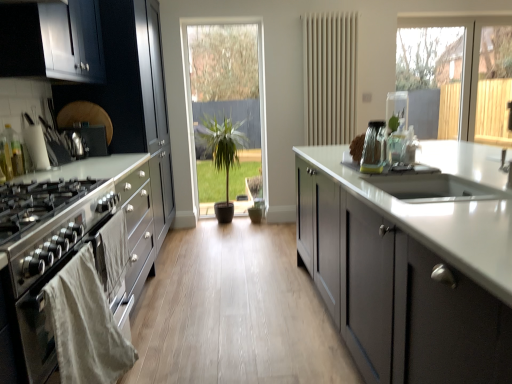
Question: Is beige matte radiator at center oriented away from satin black cabinets at left, which ranks as the 2th cabinetry in right-to-left order?

Choices:
 (A) no
 (B) yes

Answer: (A)

Question: Considering the relative sizes of beige matte radiator at center and satin black cabinets at left, which ranks as the 2th cabinetry in right-to-left order, in the image provided, is beige matte radiator at center smaller than satin black cabinets at left, which ranks as the 2th cabinetry in right-to-left order,?

Choices:
 (A) no
 (B) yes

Answer: (B)

Question: From the image's perspective, is beige matte radiator at center located above satin black cabinets at left, which ranks as the 2th cabinetry in right-to-left order?

Choices:
 (A) yes
 (B) no

Answer: (A)

Question: Considering the relative sizes of beige matte radiator at center and satin black cabinets at left, which ranks as the 2th cabinetry in right-to-left order, in the image provided, is beige matte radiator at center thinner than satin black cabinets at left, which ranks as the 2th cabinetry in right-to-left order,?

Choices:
 (A) yes
 (B) no

Answer: (A)

Question: Is beige matte radiator at center positioned in front of satin black cabinets at left, the first cabinetry positioned from the left?

Choices:
 (A) no
 (B) yes

Answer: (A)

Question: Considering the positions of beige matte radiator at center and clear glass jars at right, positioned as the 2th appliance in back-to-front order, in the image, is beige matte radiator at center taller or shorter than clear glass jars at right, positioned as the 2th appliance in back-to-front order,?

Choices:
 (A) tall
 (B) short

Answer: (A)

Question: Is beige matte radiator at center in front of or behind clear glass jars at right, which ranks as the first appliance in front-to-back order, in the image?

Choices:
 (A) behind
 (B) front

Answer: (A)

Question: Looking at their shapes, would you say beige matte radiator at center is wider or thinner than clear glass jars at right, which ranks as the first appliance in front-to-back order?

Choices:
 (A) wide
 (B) thin

Answer: (A)

Question: Does point (349, 87) appear closer or farther from the camera than point (385, 127)?

Choices:
 (A) closer
 (B) farther

Answer: (B)

Question: Does point (161, 173) appear closer or farther from the camera than point (501, 225)?

Choices:
 (A) closer
 (B) farther

Answer: (B)

Question: In terms of size, does satin black cabinets at left, the first cabinetry positioned from the left, appear bigger or smaller than matte gray cabinets at center, the 1th cabinetry when ordered from right to left?

Choices:
 (A) big
 (B) small

Answer: (B)

Question: Considering the positions of satin black cabinets at left, the first cabinetry positioned from the left, and matte gray cabinets at center, the 1th cabinetry when ordered from right to left, in the image, is satin black cabinets at left, the first cabinetry positioned from the left, wider or thinner than matte gray cabinets at center, the 1th cabinetry when ordered from right to left,?

Choices:
 (A) wide
 (B) thin

Answer: (B)

Question: From a real-world perspective, is satin black cabinets at left, the first cabinetry positioned from the left, positioned above or below matte gray cabinets at center, which is counted as the 2th cabinetry, starting from the left?

Choices:
 (A) below
 (B) above

Answer: (B)

Question: Considering their positions, is clear glass jars at right, positioned as the 2th appliance in back-to-front order, located in front of or behind beige matte radiator at center?

Choices:
 (A) front
 (B) behind

Answer: (A)

Question: In terms of height, does clear glass jars at right, the second appliance from the left, look taller or shorter compared to beige matte radiator at center?

Choices:
 (A) tall
 (B) short

Answer: (B)